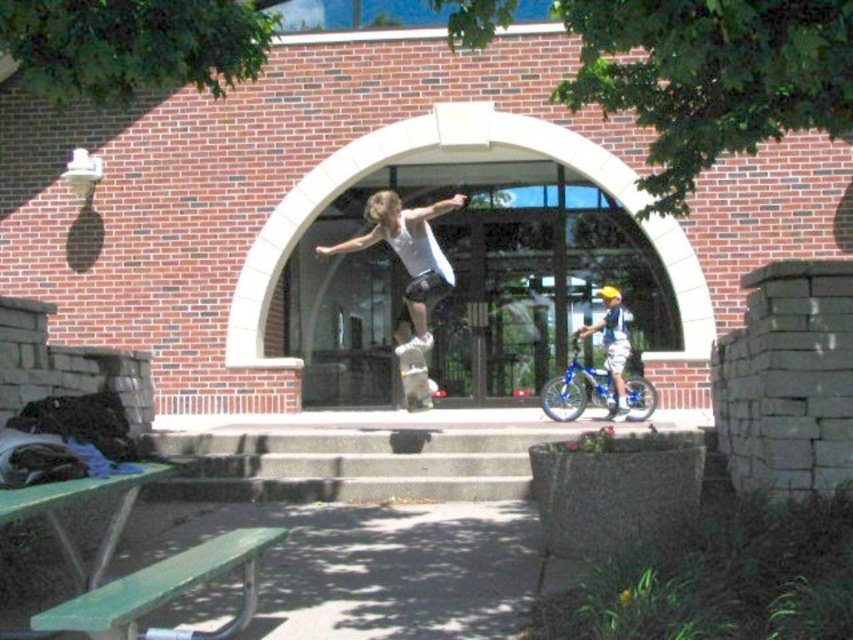
Does white matte skateboard at center have a greater width compared to blue metallic bicycle at center?

In fact, white matte skateboard at center might be narrower than blue metallic bicycle at center.

Who is more distant from viewer, (418, 300) or (610, 400)?

The point (610, 400) is behind.

Is point (418, 273) closer to viewer compared to point (627, 401)?

Yes, it is.

Where is `white matte skateboard at center`? white matte skateboard at center is located at coordinates (408, 256).

The image size is (853, 640). Describe the element at coordinates (612, 344) in the screenshot. I see `blue metallic bicycle at right` at that location.

Between point (621, 365) and point (410, 410), which one is positioned in front?

Point (410, 410) is in front.

The width and height of the screenshot is (853, 640). I want to click on blue metallic bicycle at right, so 612,344.

Which is above, green painted wood picnic table at lower left or blue metallic bicycle at center?

blue metallic bicycle at center is above.

From the picture: Which is more to the right, green painted wood picnic table at lower left or blue metallic bicycle at center?

blue metallic bicycle at center

Describe the element at coordinates (165, 589) in the screenshot. I see `green painted wood picnic table at lower left` at that location.

Where is `green painted wood picnic table at lower left`? This screenshot has width=853, height=640. green painted wood picnic table at lower left is located at coordinates (165, 589).